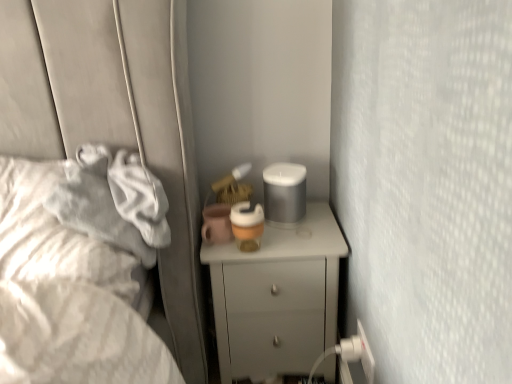
Question: From a real-world perspective, relative to white plastic electric outlet at lower right, is white soft fabric at left vertically above or below?

Choices:
 (A) below
 (B) above

Answer: (B)

Question: Considering the positions of white soft fabric at left and white plastic electric outlet at lower right in the image, is white soft fabric at left bigger or smaller than white plastic electric outlet at lower right?

Choices:
 (A) big
 (B) small

Answer: (A)

Question: Estimate the real-world distances between objects in this image. Which object is closer to the white soft fabric at left?

Choices:
 (A) white glossy chest of drawers at center
 (B) white plastic electric outlet at lower right

Answer: (A)

Question: Based on their relative distances, which object is farther from the white glossy chest of drawers at center?

Choices:
 (A) white soft fabric at left
 (B) white plastic electric outlet at lower right

Answer: (A)